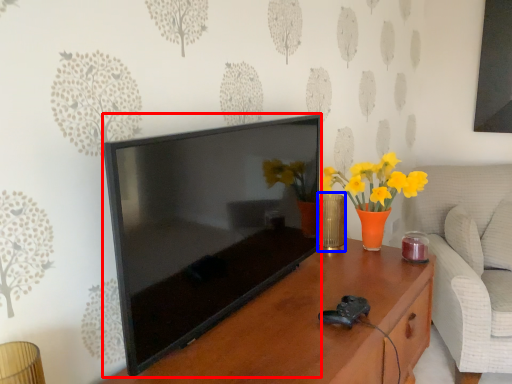
Question: Among these objects, which one is nearest to the camera, television (highlighted by a red box) or vase (highlighted by a blue box)?

Choices:
 (A) television
 (B) vase

Answer: (A)